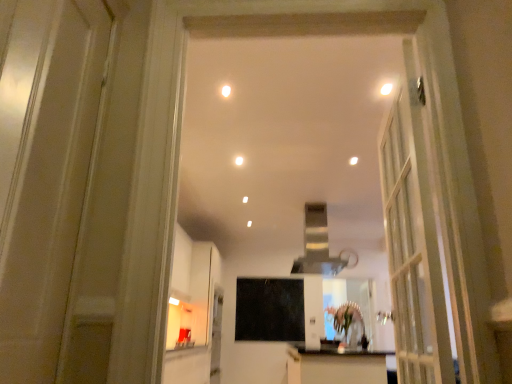
Image resolution: width=512 pixels, height=384 pixels. Describe the element at coordinates (345, 317) in the screenshot. I see `green matte flower at center` at that location.

Locate an element on the screen. green matte flower at center is located at coordinates (345, 317).

The height and width of the screenshot is (384, 512). Describe the element at coordinates (386, 89) in the screenshot. I see `white glossy light fixture at upper center, placed as the second lighting when sorted from left to right` at that location.

Describe the element at coordinates (317, 245) in the screenshot. I see `silver metallic exhaust hood at center` at that location.

This screenshot has width=512, height=384. What do you see at coordinates (226, 91) in the screenshot?
I see `white glossy light fixture at upper center, marked as the first lighting in a left-to-right arrangement` at bounding box center [226, 91].

This screenshot has width=512, height=384. Describe the element at coordinates (269, 309) in the screenshot. I see `black matte screen door at center` at that location.

Image resolution: width=512 pixels, height=384 pixels. What do you see at coordinates (348, 308) in the screenshot?
I see `clear glass mirror at center` at bounding box center [348, 308].

At what (x,y) coordinates should I click in order to perform the action: click on clear glass mirror at center. Please return your answer as a coordinate pair (x, y). This screenshot has height=384, width=512. Looking at the image, I should click on (348, 308).

Find the location of a particular element. green matte flower at center is located at coordinates (345, 317).

Is black matte screen door at center positioned far away from silver metallic exhaust hood at center?

Yes, black matte screen door at center is far from silver metallic exhaust hood at center.

Would you say black matte screen door at center is to the left or to the right of silver metallic exhaust hood at center in the picture?

Clearly, black matte screen door at center is on the left of silver metallic exhaust hood at center in the image.

Which object is closer to the camera, white glossy cabinet at lower center or black matte screen door at center?

Positioned in front is white glossy cabinet at lower center.

Is white glossy cabinet at lower center facing towards black matte screen door at center?

No.

From a real-world perspective, which is physically below, white glossy cabinet at lower center or black matte screen door at center?

white glossy cabinet at lower center.

Considering the positions of points (362, 330) and (361, 312), is point (362, 330) farther from camera compared to point (361, 312)?

No, (362, 330) is in front of (361, 312).

Considering the sizes of objects green matte flower at center and clear glass mirror at center in the image provided, who is taller, green matte flower at center or clear glass mirror at center?

Standing taller between the two is clear glass mirror at center.

From a real-world perspective, is green matte flower at center under clear glass mirror at center?

Yes, from a real-world perspective, green matte flower at center is below clear glass mirror at center.

Measure the distance between silver metallic exhaust hood at center and white glossy light fixture at upper center, placed as the second lighting when sorted from left to right.

The distance of silver metallic exhaust hood at center from white glossy light fixture at upper center, placed as the second lighting when sorted from left to right, is 9.03 feet.

Is white glossy light fixture at upper center, acting as the first lighting starting from the right, located within silver metallic exhaust hood at center?

That's incorrect, white glossy light fixture at upper center, acting as the first lighting starting from the right, is not inside silver metallic exhaust hood at center.

Is silver metallic exhaust hood at center in front of or behind white glossy light fixture at upper center, acting as the first lighting starting from the right, in the image?

Visually, silver metallic exhaust hood at center is located behind white glossy light fixture at upper center, acting as the first lighting starting from the right.

Based on their positions, is silver metallic exhaust hood at center located to the left or right of white glossy light fixture at upper center, placed as the second lighting when sorted from left to right?

In the image, silver metallic exhaust hood at center appears on the left side of white glossy light fixture at upper center, placed as the second lighting when sorted from left to right.

Could you measure the distance between white glossy light fixture at upper center, placed as the second lighting when sorted from left to right, and white glossy light fixture at upper center, marked as the first lighting in a left-to-right arrangement?

The distance of white glossy light fixture at upper center, placed as the second lighting when sorted from left to right, from white glossy light fixture at upper center, marked as the first lighting in a left-to-right arrangement, is 39.06 inches.

Considering the positions of point (390, 90) and point (224, 94), is point (390, 90) closer or farther from the camera than point (224, 94)?

Point (390, 90) appears to be closer to the viewer than point (224, 94).

In the scene shown: Is white glossy light fixture at upper center, acting as the first lighting starting from the right, not near white glossy light fixture at upper center, marked as the first lighting in a left-to-right arrangement?

No, white glossy light fixture at upper center, acting as the first lighting starting from the right, is in close proximity to white glossy light fixture at upper center, marked as the first lighting in a left-to-right arrangement.

From a real-world perspective, is black matte screen door at center on white glossy cabinet at lower center?

Indeed, from a real-world perspective, black matte screen door at center stands above white glossy cabinet at lower center.

Can you confirm if black matte screen door at center is wider than white glossy cabinet at lower center?

Incorrect, the width of black matte screen door at center does not surpass that of white glossy cabinet at lower center.

Based on the photo, considering the sizes of black matte screen door at center and white glossy cabinet at lower center in the image, is black matte screen door at center bigger or smaller than white glossy cabinet at lower center?

black matte screen door at center is smaller than white glossy cabinet at lower center.

Considering the positions of objects black matte screen door at center and white glossy cabinet at lower center in the image provided, who is more to the left, black matte screen door at center or white glossy cabinet at lower center?

Positioned to the left is black matte screen door at center.

Is white glossy light fixture at upper center, the 2th lighting from the right, outside of white glossy cabinet at lower center?

Yes, white glossy light fixture at upper center, the 2th lighting from the right, is outside of white glossy cabinet at lower center.

Looking at this image, from a real-world perspective, which object stands above the other?

white glossy light fixture at upper center, marked as the first lighting in a left-to-right arrangement, from a real-world perspective.

Does white glossy light fixture at upper center, the 2th lighting from the right, appear on the right side of white glossy cabinet at lower center?

No, white glossy light fixture at upper center, the 2th lighting from the right, is not to the right of white glossy cabinet at lower center.

I want to click on screen door below the silver metallic exhaust hood at center (from a real-world perspective), so (x=269, y=309).

At what (x,y) coordinates should I click in order to perform the action: click on screen door above the white glossy cabinet at lower center (from a real-world perspective). Please return your answer as a coordinate pair (x, y). Looking at the image, I should click on (269, 309).

Looking at the image, which one is located further to clear glass mirror at center, white glossy light fixture at upper center, marked as the first lighting in a left-to-right arrangement, or silver metallic exhaust hood at center?

white glossy light fixture at upper center, marked as the first lighting in a left-to-right arrangement, is further to clear glass mirror at center.

Estimate the real-world distances between objects in this image. Which object is closer to white glossy cabinet at lower center, black matte screen door at center or white glossy light fixture at upper center, marked as the first lighting in a left-to-right arrangement?

Among the two, black matte screen door at center is located nearer to white glossy cabinet at lower center.

Looking at the image, which one is located further to green matte flower at center, black matte screen door at center or white glossy door at left?

black matte screen door at center lies further to green matte flower at center than the other object.

Estimate the real-world distances between objects in this image. Which object is further from silver metallic exhaust hood at center, clear glass mirror at center or white glossy cabinet at lower center?

clear glass mirror at center.

Based on their spatial positions, is black matte screen door at center or green matte flower at center closer to silver metallic exhaust hood at center?

green matte flower at center is positioned closer to the anchor silver metallic exhaust hood at center.

Based on their spatial positions, is green matte flower at center or white glossy light fixture at upper center, the 2th lighting from the right, closer to white glossy cabinet at lower center?

green matte flower at center lies closer to white glossy cabinet at lower center than the other object.

From the image, which object appears to be farther from white glossy light fixture at upper center, acting as the first lighting starting from the right, green matte flower at center or white glossy cabinet at lower center?

white glossy cabinet at lower center.

From the image, which object appears to be farther from silver metallic exhaust hood at center, white glossy door at left or white glossy light fixture at upper center, acting as the first lighting starting from the right?

The object further to silver metallic exhaust hood at center is white glossy door at left.

Locate an element on the screen. cabinetry positioned between white glossy light fixture at upper center, acting as the first lighting starting from the right, and clear glass mirror at center from near to far is located at coordinates (335, 365).

Where is `flower positioned between white glossy light fixture at upper center, placed as the second lighting when sorted from left to right, and clear glass mirror at center from near to far`? Image resolution: width=512 pixels, height=384 pixels. flower positioned between white glossy light fixture at upper center, placed as the second lighting when sorted from left to right, and clear glass mirror at center from near to far is located at coordinates (345, 317).

Locate an element on the screen. Image resolution: width=512 pixels, height=384 pixels. flower between white glossy cabinet at lower center and clear glass mirror at center from front to back is located at coordinates (345, 317).

Identify the location of mirror located between white glossy light fixture at upper center, the 2th lighting from the right, and black matte screen door at center in the depth direction. The height and width of the screenshot is (384, 512). (348, 308).